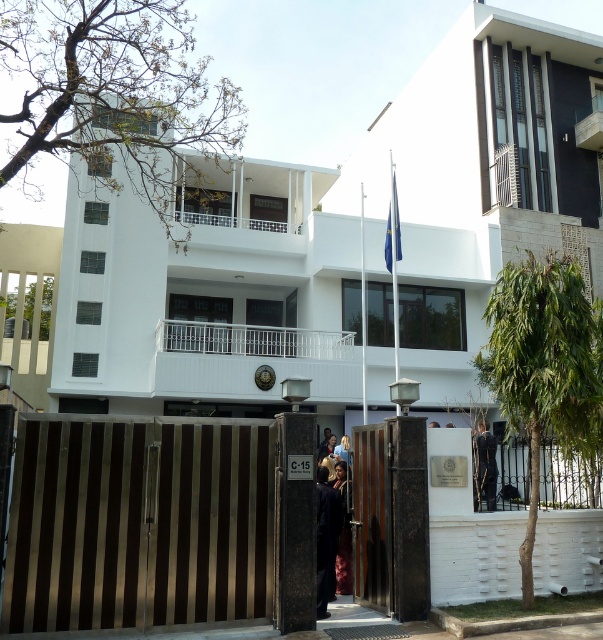
Question: Observing the image, what is the correct spatial positioning of dark blue fabric coat at center in reference to dark suit at center?

Choices:
 (A) above
 (B) below

Answer: (B)

Question: Which object is positioned closest to the dark brown leather jacket at center?

Choices:
 (A) dark suit at center
 (B) dark blue fabric coat at center
 (C) gold metallic gate at center

Answer: (B)

Question: Which of the following is the farthest from the observer?

Choices:
 (A) dark blue fabric coat at center
 (B) dark brown leather jacket at center
 (C) gold metallic gate at center

Answer: (B)

Question: Estimate the real-world distances between objects in this image. Which object is farther from the dark suit at center?

Choices:
 (A) dark brown leather jacket at center
 (B) dark blue fabric coat at center
 (C) gold metallic gate at center

Answer: (C)

Question: Does dark suit at center appear under dark brown leather jacket at center?

Choices:
 (A) yes
 (B) no

Answer: (B)

Question: Does gold metallic gate at center appear under dark suit at center?

Choices:
 (A) yes
 (B) no

Answer: (B)